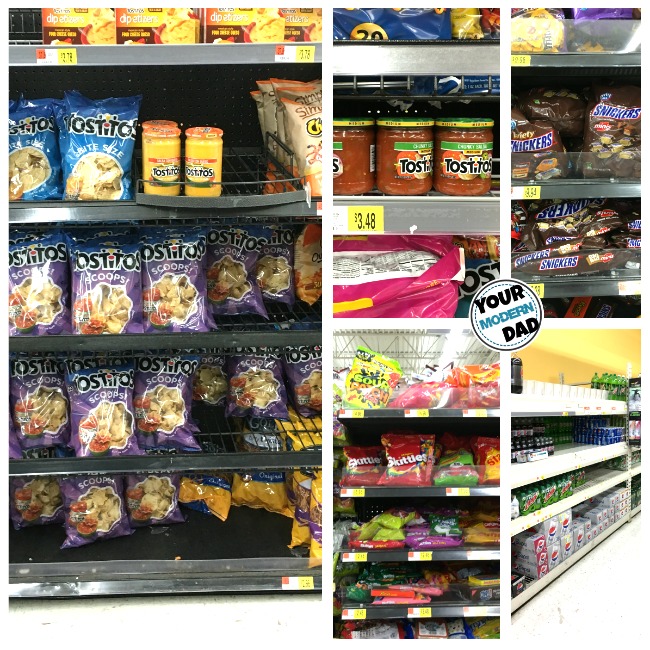
Where is `floor`? floor is located at coordinates 595,606, 262,619.